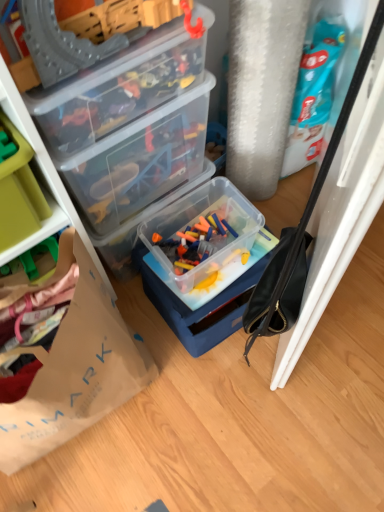
Question: Is transparent plastic container at upper left, the second box positioned from the top, oriented away from brown paper bag at lower left?

Choices:
 (A) no
 (B) yes

Answer: (A)

Question: Considering the relative sizes of transparent plastic container at upper left, the second box positioned from the top, and brown paper bag at lower left in the image provided, is transparent plastic container at upper left, the second box positioned from the top, wider than brown paper bag at lower left?

Choices:
 (A) no
 (B) yes

Answer: (A)

Question: Does transparent plastic container at upper left, the second box positioned from the top, have a lesser height compared to brown paper bag at lower left?

Choices:
 (A) yes
 (B) no

Answer: (A)

Question: Is transparent plastic container at upper left, positioned as the 2th box in bottom-to-top order, further to camera compared to brown paper bag at lower left?

Choices:
 (A) yes
 (B) no

Answer: (A)

Question: Is transparent plastic container at upper left, positioned as the 2th box in bottom-to-top order, to the right of brown paper bag at lower left from the viewer's perspective?

Choices:
 (A) no
 (B) yes

Answer: (B)

Question: From the image's perspective, is transparent plastic container at upper left, positioned as the 2th box in bottom-to-top order, on brown paper bag at lower left?

Choices:
 (A) yes
 (B) no

Answer: (A)

Question: Can green plastic storage box at left be found inside brown paper bag at lower left?

Choices:
 (A) yes
 (B) no

Answer: (B)

Question: Does brown paper bag at lower left appear on the left side of green plastic storage box at left?

Choices:
 (A) yes
 (B) no

Answer: (B)

Question: Does brown paper bag at lower left have a smaller size compared to green plastic storage box at left?

Choices:
 (A) no
 (B) yes

Answer: (A)

Question: From a real-world perspective, is brown paper bag at lower left on green plastic storage box at left?

Choices:
 (A) no
 (B) yes

Answer: (A)

Question: From the image's perspective, is brown paper bag at lower left under green plastic storage box at left?

Choices:
 (A) no
 (B) yes

Answer: (B)

Question: From a real-world perspective, does brown paper bag at lower left sit lower than green plastic storage box at left?

Choices:
 (A) no
 (B) yes

Answer: (B)

Question: Is transparent plastic container at upper left, positioned as the 2th box in bottom-to-top order, oriented towards green plastic storage box at left?

Choices:
 (A) yes
 (B) no

Answer: (B)